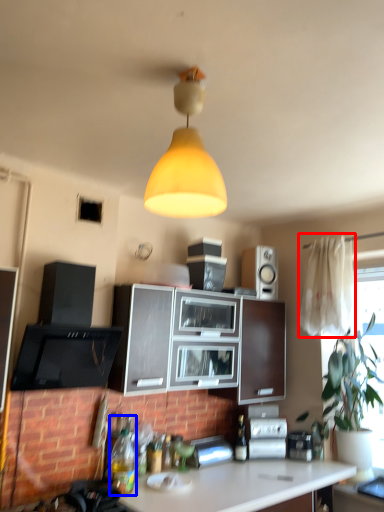
Question: Which object is closer to the camera taking this photo, curtain (highlighted by a red box) or bottle (highlighted by a blue box)?

Choices:
 (A) curtain
 (B) bottle

Answer: (B)